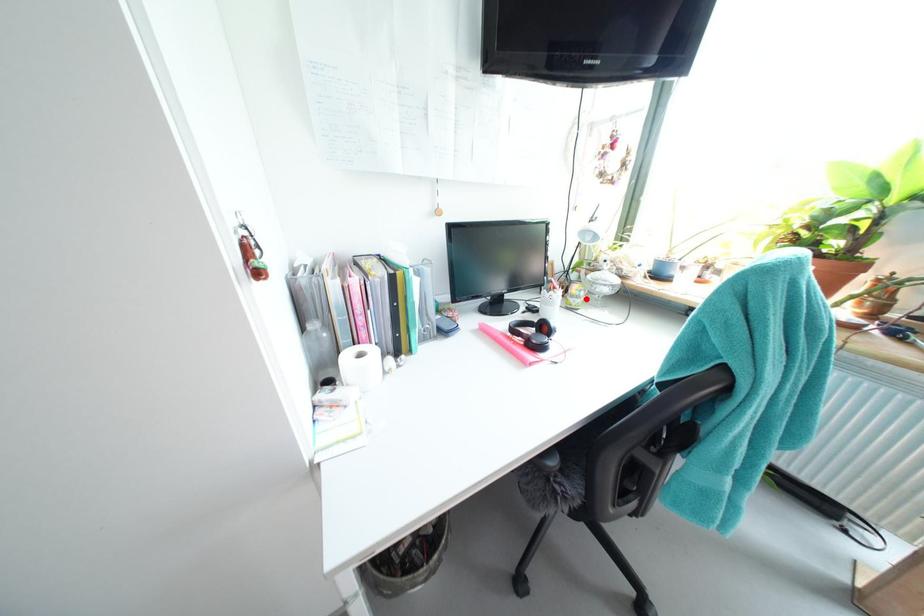
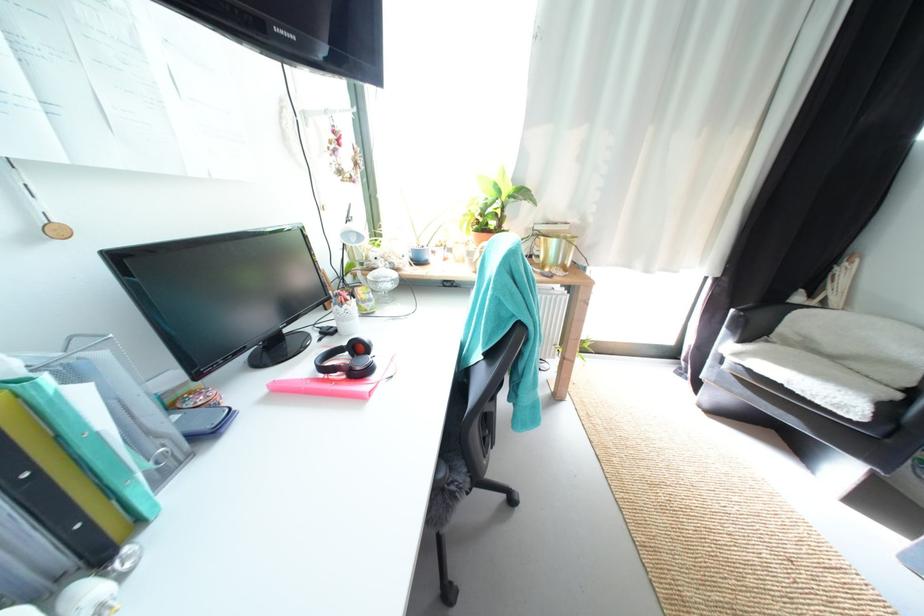
Find the pixel in the second image that matches the highlighted location in the first image.

(378, 302)